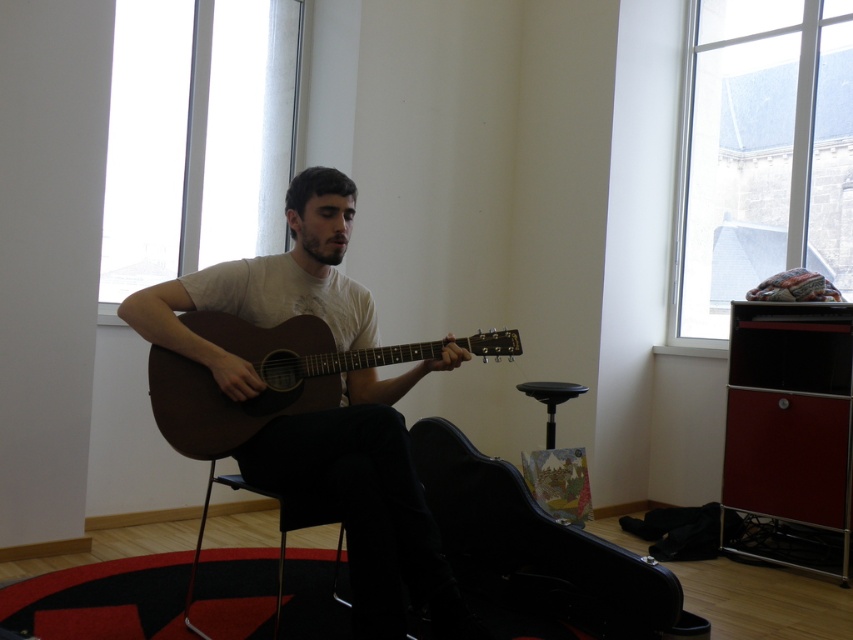
Does black hard case at lower center have a smaller size compared to metallic black chair at center?

Correct, black hard case at lower center occupies less space than metallic black chair at center.

Image resolution: width=853 pixels, height=640 pixels. What do you see at coordinates (537, 552) in the screenshot?
I see `black hard case at lower center` at bounding box center [537, 552].

In order to click on black hard case at lower center in this screenshot , I will do `click(537, 552)`.

Does matte brown guitar at center appear under black plastic stool at center?

No.

Does matte brown guitar at center have a smaller size compared to black plastic stool at center?

Actually, matte brown guitar at center might be larger than black plastic stool at center.

Describe the element at coordinates (368, 499) in the screenshot. I see `matte brown guitar at center` at that location.

Locate an element on the screen. The height and width of the screenshot is (640, 853). matte brown guitar at center is located at coordinates 368,499.

Does matte brown guitar at center have a lesser height compared to matte brown acoustic guitar at center?

In fact, matte brown guitar at center may be taller than matte brown acoustic guitar at center.

Describe the element at coordinates (368, 499) in the screenshot. I see `matte brown guitar at center` at that location.

What are the coordinates of `matte brown guitar at center` in the screenshot? It's located at (368, 499).